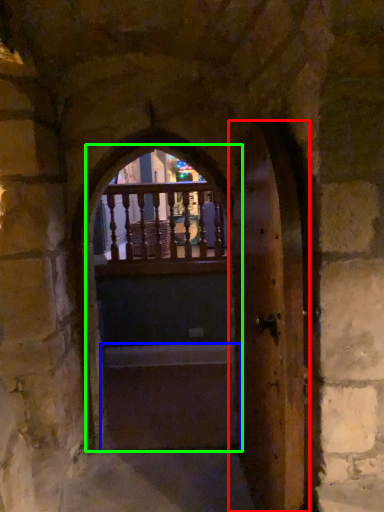
Question: Which object is positioned farthest from door (highlighted by a red box)? Select from stairwell (highlighted by a blue box) and door (highlighted by a green box).

Choices:
 (A) stairwell
 (B) door

Answer: (B)